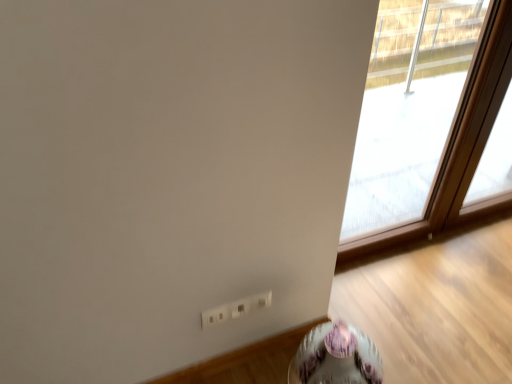
Question: Is transparent glass window at upper right wider or thinner than porcelain floral-patterned table at lower right?

Choices:
 (A) thin
 (B) wide

Answer: (A)

Question: Is transparent glass window at upper right bigger or smaller than porcelain floral-patterned table at lower right?

Choices:
 (A) small
 (B) big

Answer: (B)

Question: Relative to porcelain floral-patterned table at lower right, is transparent glass window at upper right in front or behind?

Choices:
 (A) front
 (B) behind

Answer: (B)

Question: Is porcelain floral-patterned table at lower right bigger or smaller than transparent glass window at upper right?

Choices:
 (A) small
 (B) big

Answer: (A)

Question: Would you say porcelain floral-patterned table at lower right is inside or outside transparent glass window at upper right?

Choices:
 (A) inside
 (B) outside

Answer: (B)

Question: In the image, is porcelain floral-patterned table at lower right on the left side or the right side of transparent glass window at upper right?

Choices:
 (A) left
 (B) right

Answer: (A)

Question: Considering their positions, is porcelain floral-patterned table at lower right located in front of or behind transparent glass window at upper right?

Choices:
 (A) behind
 (B) front

Answer: (B)